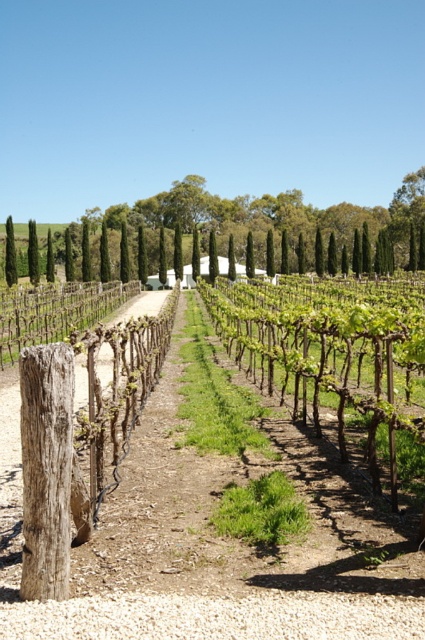
Question: Does brown wooden fence at center lie behind green textured cypress at left?

Choices:
 (A) yes
 (B) no

Answer: (B)

Question: Which point is farther to the camera?

Choices:
 (A) (10, 236)
 (B) (42, 289)

Answer: (A)

Question: Which point is farther to the camera?

Choices:
 (A) brown wooden fence at center
 (B) green textured cypress at left

Answer: (B)

Question: Which object appears farthest from the camera in this image?

Choices:
 (A) green textured cypress at left
 (B) brown wooden fence at center

Answer: (A)

Question: Is brown wooden fence at center wider than green textured cypress at left?

Choices:
 (A) no
 (B) yes

Answer: (B)

Question: In this image, where is brown wooden fence at center located relative to green textured cypress at left?

Choices:
 (A) right
 (B) left

Answer: (A)